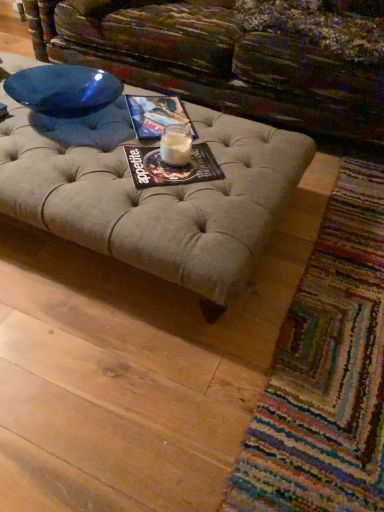
Locate an element on the screen. The height and width of the screenshot is (512, 384). blank area to the left of multicolored woven mat at lower right is located at coordinates (163, 321).